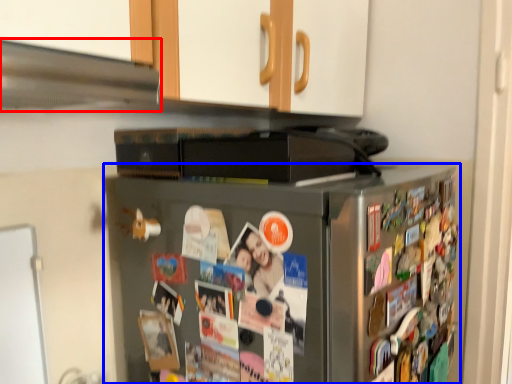
Question: Which of the following is the farthest to the observer, exhaust hood (highlighted by a red box) or refrigerator (highlighted by a blue box)?

Choices:
 (A) exhaust hood
 (B) refrigerator

Answer: (B)